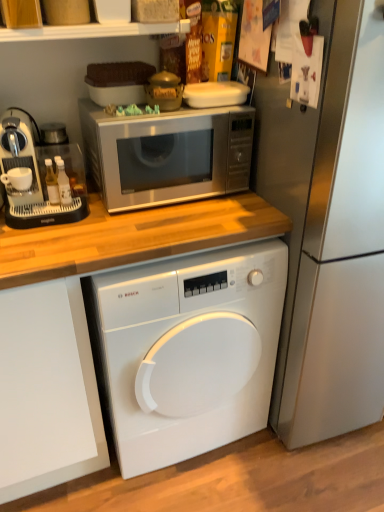
Question: Considering the relative positions of satin silver refrigerator at right and satin silver microwave at upper center in the image provided, is satin silver refrigerator at right to the left or to the right of satin silver microwave at upper center?

Choices:
 (A) right
 (B) left

Answer: (A)

Question: Looking at their shapes, would you say satin silver refrigerator at right is wider or thinner than satin silver microwave at upper center?

Choices:
 (A) thin
 (B) wide

Answer: (B)

Question: Which object is positioned farthest from the white glossy washing machine at center?

Choices:
 (A) white matte plastic container at upper center
 (B) satin silver refrigerator at right
 (C) white glossy shelf at upper center
 (D) satin silver microwave at upper center
 (E) white plastic coffee machine at left

Answer: (C)

Question: Which of these objects is positioned closest to the white plastic coffee machine at left?

Choices:
 (A) satin silver microwave at upper center
 (B) white glossy washing machine at center
 (C) white glossy shelf at upper center
 (D) white matte plastic container at upper center
 (E) satin silver refrigerator at right

Answer: (A)